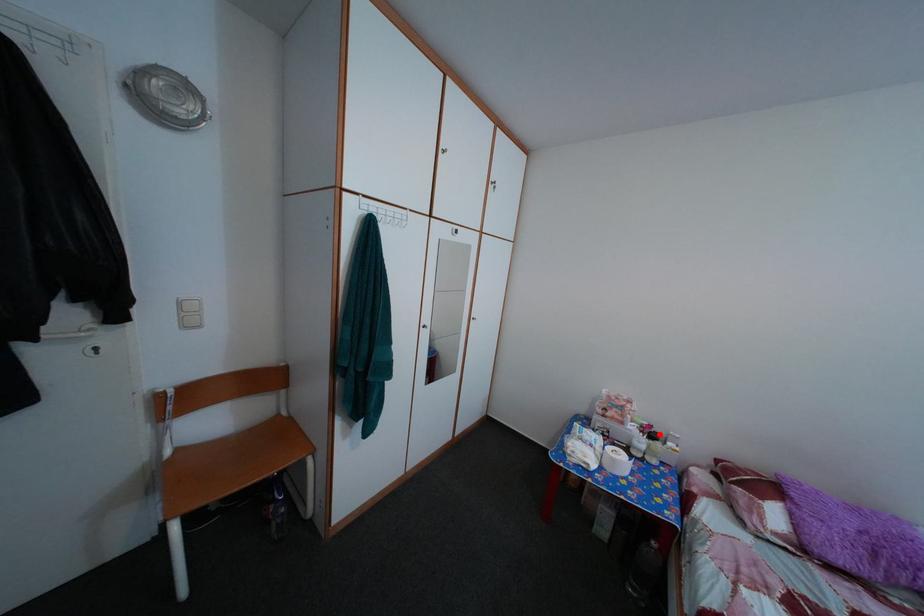
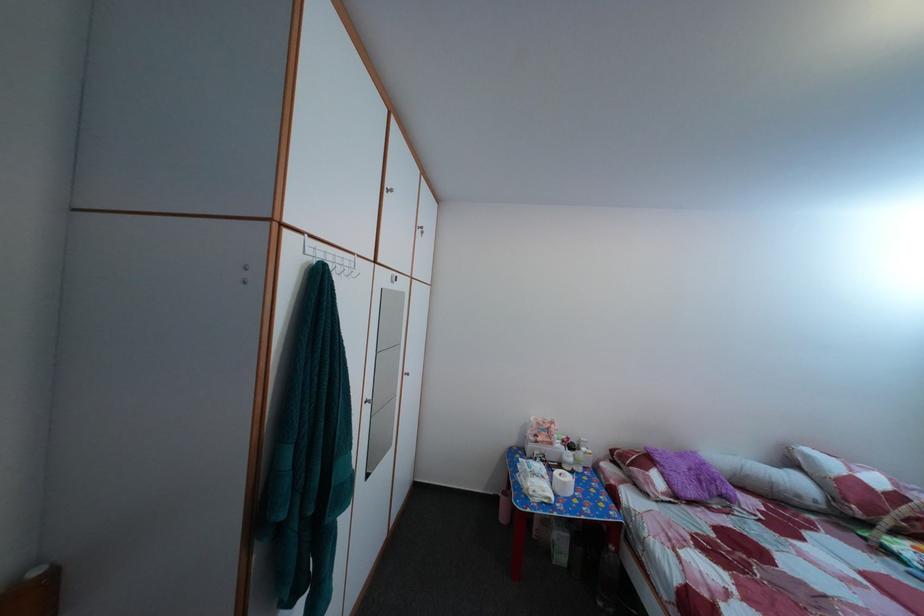
Find the pixel in the second image that matches the highlighted location in the first image.

(578, 447)